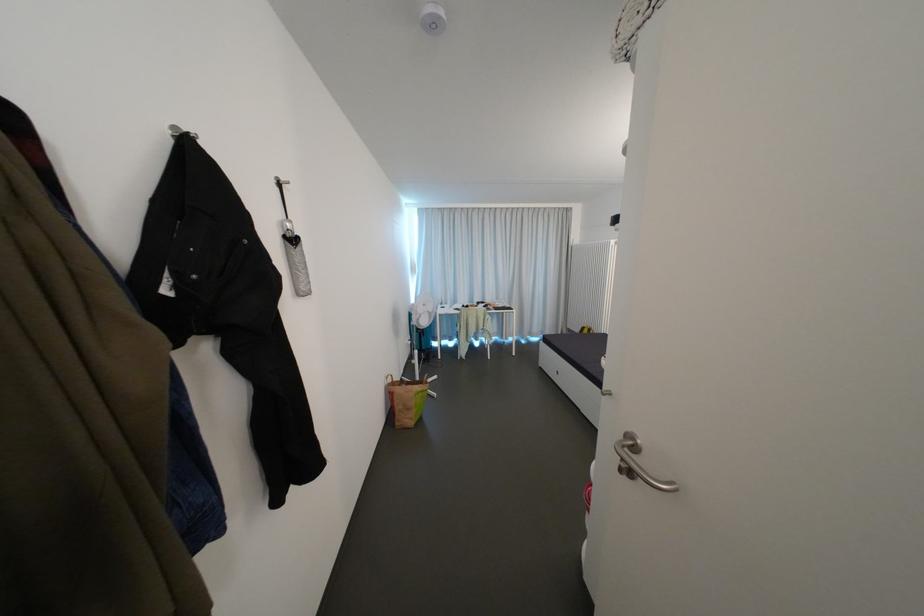
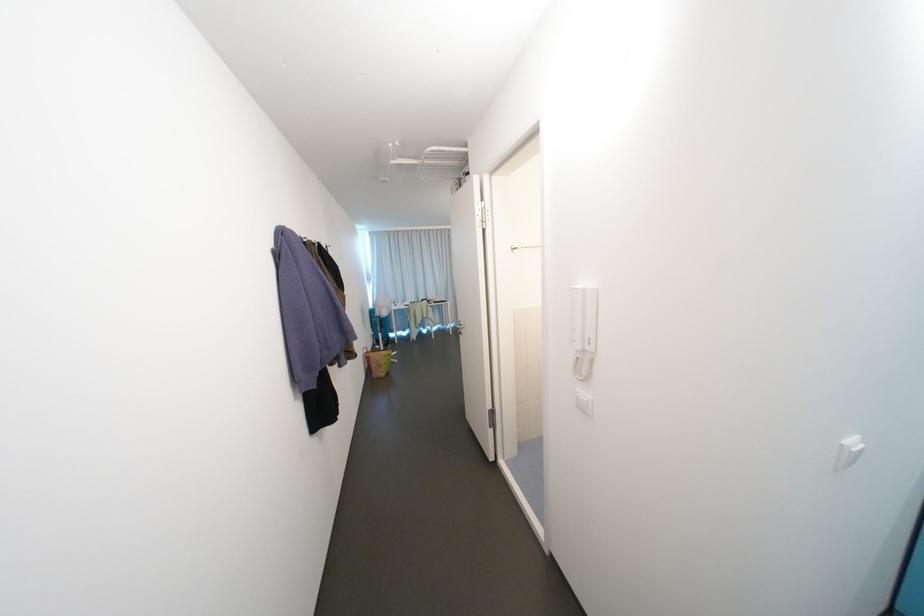
In the second image, find the point that corresponds to (x=454, y=305) in the first image.

(406, 304)